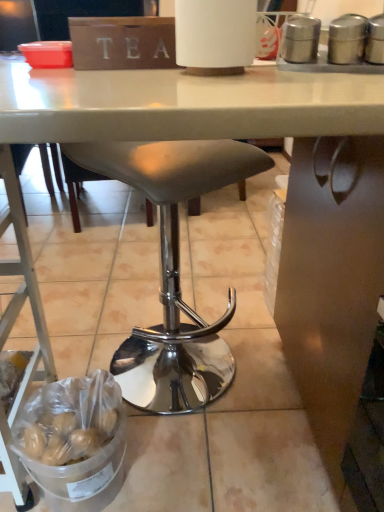
What is the approximate width of metallic silver ladder at lower left?

The width of metallic silver ladder at lower left is 16.88 inches.

What do you see at coordinates (14, 323) in the screenshot? I see `metallic silver ladder at lower left` at bounding box center [14, 323].

In the scene shown: Measure the distance between point [138,383] and camera.

Point [138,383] is 3.94 feet away from camera.

What are the coordinates of `metallic silver ladder at lower left` in the screenshot? It's located at (14, 323).

Where is `ladder lying below the silver metallic canisters at upper right (from the image's perspective)`? The height and width of the screenshot is (512, 384). ladder lying below the silver metallic canisters at upper right (from the image's perspective) is located at coordinates (14, 323).

From the image's perspective, would you say silver metallic canisters at upper right is shown under metallic silver ladder at lower left?

No, from the image's perspective, silver metallic canisters at upper right is not beneath metallic silver ladder at lower left.

In the scene shown: Is silver metallic canisters at upper right at the left side of metallic silver ladder at lower left?

In fact, silver metallic canisters at upper right is to the right of metallic silver ladder at lower left.

Is the depth of silver metallic canisters at upper right less than that of metallic silver ladder at lower left?

No, silver metallic canisters at upper right is further to the viewer.

Which is more to the left, silver metallic canisters at upper right or matte gray stool at center?

matte gray stool at center is more to the left.

Based on the photo, is silver metallic canisters at upper right not within matte gray stool at center?

Yes.

Is silver metallic canisters at upper right looking in the opposite direction of matte gray stool at center?

No, matte gray stool at center is not at the back of silver metallic canisters at upper right.

Would you say metallic silver ladder at lower left is a long distance from silver metallic canisters at upper right?

Actually, metallic silver ladder at lower left and silver metallic canisters at upper right are a little close together.

From a real-world perspective, does metallic silver ladder at lower left stand above silver metallic canisters at upper right?

No, from a real-world perspective, metallic silver ladder at lower left is not on top of silver metallic canisters at upper right.

Based on the photo, in terms of size, does metallic silver ladder at lower left appear bigger or smaller than silver metallic canisters at upper right?

metallic silver ladder at lower left is bigger than silver metallic canisters at upper right.

In the image, is metallic silver ladder at lower left positioned in front of or behind silver metallic canisters at upper right?

Visually, metallic silver ladder at lower left is located in front of silver metallic canisters at upper right.

Would you say matte gray stool at center contains metallic silver ladder at lower left?

No, metallic silver ladder at lower left is not surrounded by matte gray stool at center.

Would you consider matte gray stool at center to be distant from metallic silver ladder at lower left?

No, matte gray stool at center is not far away from metallic silver ladder at lower left.

Does matte gray stool at center have a smaller size compared to metallic silver ladder at lower left?

Actually, matte gray stool at center might be larger than metallic silver ladder at lower left.

From the image's perspective, is matte gray stool at center over metallic silver ladder at lower left?

Yes, from the image's perspective, matte gray stool at center is on top of metallic silver ladder at lower left.

Is metallic silver ladder at lower left far from matte gray stool at center?

No, metallic silver ladder at lower left is in close proximity to matte gray stool at center.

What's the angular difference between metallic silver ladder at lower left and matte gray stool at center's facing directions?

They differ by 34.4 degrees in their facing directions.

Is metallic silver ladder at lower left not inside matte gray stool at center?

That's correct, metallic silver ladder at lower left is outside of matte gray stool at center.

In the scene shown: From the image's perspective, is metallic silver ladder at lower left located above matte gray stool at center?

No, from the image's perspective, metallic silver ladder at lower left is not over matte gray stool at center.

Is matte gray stool at center in front of silver metallic canisters at upper right?

No, matte gray stool at center is behind silver metallic canisters at upper right.

Between matte gray stool at center and silver metallic canisters at upper right, which one has smaller width?

Thinner between the two is silver metallic canisters at upper right.

The image size is (384, 512). There is a matte gray stool at center. In order to click on appliance above it (from a real-world perspective) in this screenshot , I will do `click(347, 39)`.

Is point (162, 142) positioned after point (353, 14)?

Yes, it is behind point (353, 14).

I want to click on appliance lying on the right of metallic silver ladder at lower left, so click(347, 39).

This screenshot has width=384, height=512. In order to click on appliance located above the matte gray stool at center (from a real-world perspective) in this screenshot , I will do `click(347, 39)`.

From the picture: When comparing their distances from metallic silver ladder at lower left, does matte gray stool at center or silver metallic canisters at upper right seem closer?

Among the two, matte gray stool at center is located nearer to metallic silver ladder at lower left.

Which object lies nearer to the anchor point silver metallic canisters at upper right, metallic silver ladder at lower left or matte gray stool at center?

Among the two, matte gray stool at center is located nearer to silver metallic canisters at upper right.

Which object lies nearer to the anchor point metallic silver ladder at lower left, silver metallic canisters at upper right or matte gray stool at center?

matte gray stool at center.

Estimate the real-world distances between objects in this image. Which object is further from matte gray stool at center, silver metallic canisters at upper right or metallic silver ladder at lower left?

silver metallic canisters at upper right is further to matte gray stool at center.

Which object lies further to the anchor point matte gray stool at center, metallic silver ladder at lower left or silver metallic canisters at upper right?

silver metallic canisters at upper right is positioned further to the anchor matte gray stool at center.

Which object lies further to the anchor point silver metallic canisters at upper right, matte gray stool at center or metallic silver ladder at lower left?

Among the two, metallic silver ladder at lower left is located further to silver metallic canisters at upper right.

Where is `stool between metallic silver ladder at lower left and silver metallic canisters at upper right from left to right`? The image size is (384, 512). stool between metallic silver ladder at lower left and silver metallic canisters at upper right from left to right is located at coordinates (174, 268).